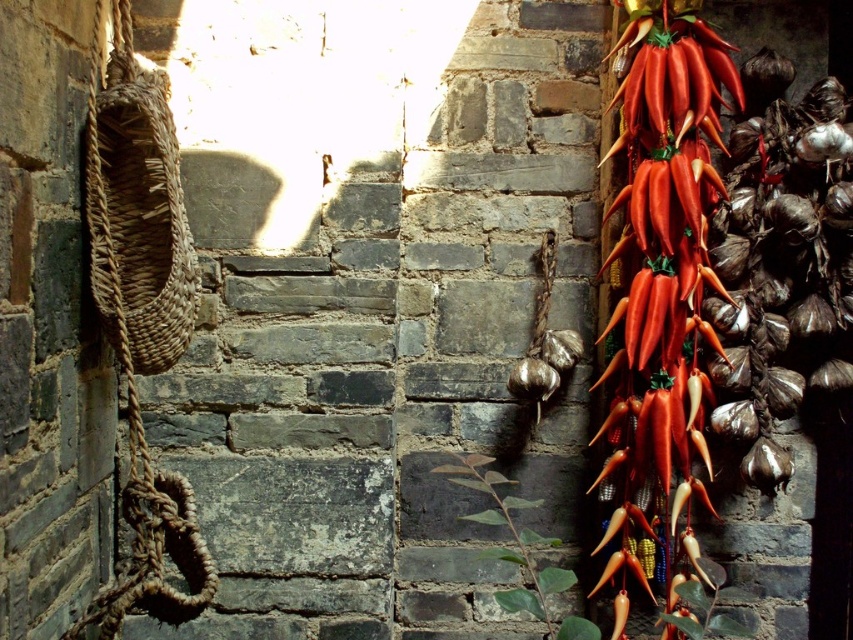
Is bright red chili peppers at center-right wider than green matte plant at center?

No, bright red chili peppers at center-right is not wider than green matte plant at center.

How distant is bright red chili peppers at center-right from green matte plant at center?

bright red chili peppers at center-right and green matte plant at center are 10.16 inches apart.

The height and width of the screenshot is (640, 853). Find the location of `bright red chili peppers at center-right`. bright red chili peppers at center-right is located at coordinates (662, 284).